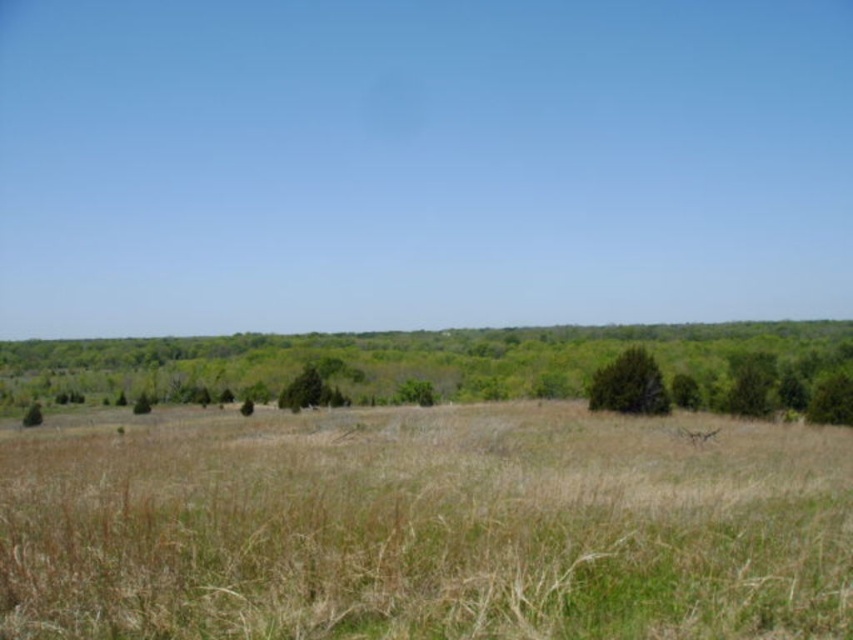
Is dry grass at center positioned behind green matte tree at center?

No, it is in front of green matte tree at center.

From the picture: Does dry grass at center appear over green matte tree at center?

Indeed, dry grass at center is positioned over green matte tree at center.

Does point (360, 412) come in front of point (323, 392)?

Yes.

Find the location of a particular element. dry grass at center is located at coordinates (426, 528).

Between point (236, 369) and point (628, 348), which one is positioned behind?

The point (236, 369) is more distant.

Can you confirm if green leafy tree at center is bigger than green matte tree at center-right?

Yes, green leafy tree at center is bigger than green matte tree at center-right.

Does point (405, 394) come behind point (621, 387)?

Yes, it is behind point (621, 387).

Where is `green leafy tree at center`? This screenshot has width=853, height=640. green leafy tree at center is located at coordinates (416, 362).

Can you confirm if dry grass at center is thinner than green leafy tree at center?

Yes.

Is point (523, 497) closer to camera compared to point (277, 381)?

Yes, it is.

The width and height of the screenshot is (853, 640). What are the coordinates of `dry grass at center` in the screenshot? It's located at (426, 528).